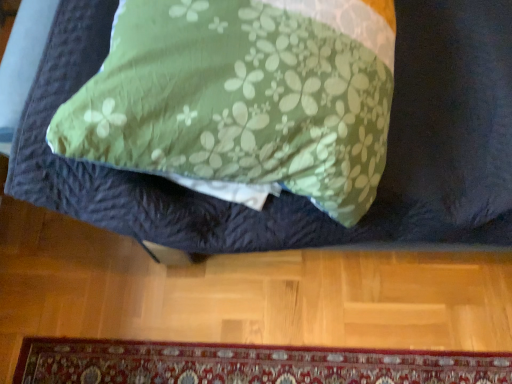
Question: Is carpeted mat at lower center wider than green floral fabric at center?

Choices:
 (A) no
 (B) yes

Answer: (A)

Question: Would you say carpeted mat at lower center is a long distance from green floral fabric at center?

Choices:
 (A) no
 (B) yes

Answer: (A)

Question: Would you say carpeted mat at lower center contains green floral fabric at center?

Choices:
 (A) no
 (B) yes

Answer: (A)

Question: Does carpeted mat at lower center have a larger size compared to green floral fabric at center?

Choices:
 (A) no
 (B) yes

Answer: (A)

Question: Is carpeted mat at lower center at the right side of green floral fabric at center?

Choices:
 (A) yes
 (B) no

Answer: (B)

Question: Can you confirm if carpeted mat at lower center is shorter than green floral fabric at center?

Choices:
 (A) no
 (B) yes

Answer: (B)

Question: Is green floral fabric at center aimed at carpeted mat at lower center?

Choices:
 (A) yes
 (B) no

Answer: (B)

Question: Does green floral fabric at center have a lesser height compared to carpeted mat at lower center?

Choices:
 (A) yes
 (B) no

Answer: (B)

Question: Is green floral fabric at center bigger than carpeted mat at lower center?

Choices:
 (A) no
 (B) yes

Answer: (B)

Question: Does green floral fabric at center come behind carpeted mat at lower center?

Choices:
 (A) no
 (B) yes

Answer: (A)

Question: Can you confirm if green floral fabric at center is smaller than carpeted mat at lower center?

Choices:
 (A) no
 (B) yes

Answer: (A)

Question: Is green floral fabric at center positioned beyond the bounds of carpeted mat at lower center?

Choices:
 (A) yes
 (B) no

Answer: (A)

Question: From a real-world perspective, is green floral fabric at center above or below carpeted mat at lower center?

Choices:
 (A) above
 (B) below

Answer: (A)